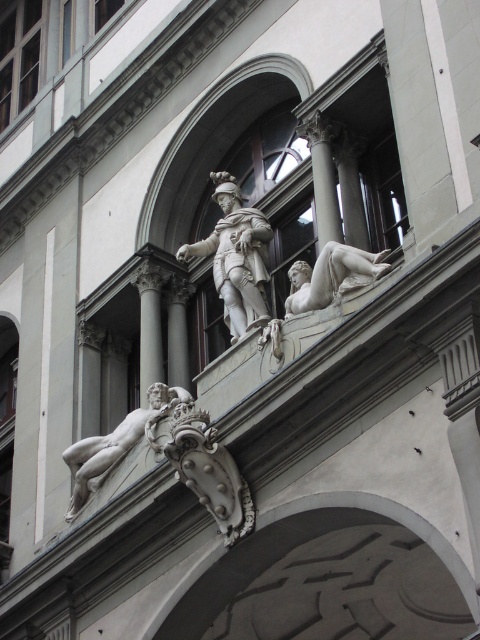
Question: Based on their relative distances, which object is nearer to the white marble statue at center?

Choices:
 (A) white marble nude at lower left
 (B) white marble reclining figure at right

Answer: (B)

Question: Estimate the real-world distances between objects in this image. Which object is closer to the white marble statue at center?

Choices:
 (A) white marble nude at lower left
 (B) white marble reclining figure at right

Answer: (B)

Question: Is white marble nude at lower left smaller than white marble reclining figure at right?

Choices:
 (A) yes
 (B) no

Answer: (B)

Question: Which object appears farthest from the camera in this image?

Choices:
 (A) white marble nude at lower left
 (B) white marble statue at center

Answer: (A)

Question: Does white marble nude at lower left have a lesser width compared to white marble reclining figure at right?

Choices:
 (A) yes
 (B) no

Answer: (B)

Question: Is white marble statue at center to the left of white marble nude at lower left from the viewer's perspective?

Choices:
 (A) yes
 (B) no

Answer: (B)